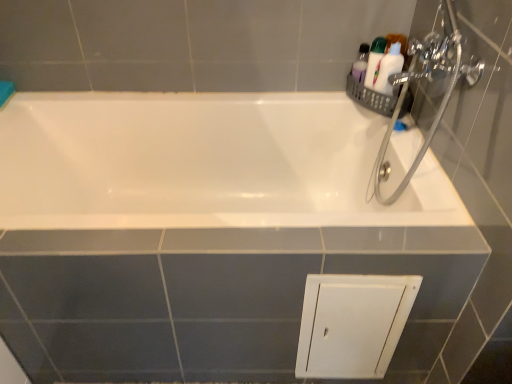
Question: Is white glossy toiletries at upper right, the 1th toiletry in the left-to-right sequence, turned away from white plastic bottle at upper right, the 2th toiletry positioned from the left?

Choices:
 (A) yes
 (B) no

Answer: (B)

Question: Is white glossy toiletries at upper right, the 1th toiletry in the left-to-right sequence, thinner than white plastic bottle at upper right, the 2th toiletry positioned from the left?

Choices:
 (A) yes
 (B) no

Answer: (B)

Question: Does white glossy toiletries at upper right, acting as the 2th toiletry starting from the right, turn towards white plastic bottle at upper right, the 2th toiletry positioned from the left?

Choices:
 (A) no
 (B) yes

Answer: (A)

Question: From a real-world perspective, is white glossy toiletries at upper right, acting as the 2th toiletry starting from the right, on top of white plastic bottle at upper right, the 2th toiletry positioned from the left?

Choices:
 (A) no
 (B) yes

Answer: (A)

Question: Does white glossy toiletries at upper right, the 1th toiletry in the left-to-right sequence, have a greater height compared to white plastic bottle at upper right, the 2th toiletry positioned from the left?

Choices:
 (A) yes
 (B) no

Answer: (B)

Question: From the image's perspective, is white glossy toiletries at upper right, acting as the 2th toiletry starting from the right, on white plastic bottle at upper right, the 2th toiletry positioned from the left?

Choices:
 (A) yes
 (B) no

Answer: (A)

Question: Is chrome metallic showerhead at upper right completely or partially inside white plastic bottle at upper right, arranged as the first toiletry when viewed from the right?

Choices:
 (A) no
 (B) yes

Answer: (A)

Question: Does white plastic bottle at upper right, arranged as the first toiletry when viewed from the right, have a lesser width compared to chrome metallic showerhead at upper right?

Choices:
 (A) no
 (B) yes

Answer: (B)

Question: Is white plastic bottle at upper right, the 2th toiletry positioned from the left, next to chrome metallic showerhead at upper right?

Choices:
 (A) no
 (B) yes

Answer: (A)

Question: Considering the relative positions of white plastic bottle at upper right, arranged as the first toiletry when viewed from the right, and chrome metallic showerhead at upper right in the image provided, is white plastic bottle at upper right, arranged as the first toiletry when viewed from the right, to the left of chrome metallic showerhead at upper right from the viewer's perspective?

Choices:
 (A) yes
 (B) no

Answer: (B)

Question: Considering the relative sizes of white plastic bottle at upper right, arranged as the first toiletry when viewed from the right, and chrome metallic showerhead at upper right in the image provided, is white plastic bottle at upper right, arranged as the first toiletry when viewed from the right, taller than chrome metallic showerhead at upper right?

Choices:
 (A) no
 (B) yes

Answer: (A)

Question: Can you confirm if white glossy toiletries at upper right, the 1th toiletry in the left-to-right sequence, is bigger than chrome metallic showerhead at upper right?

Choices:
 (A) yes
 (B) no

Answer: (B)